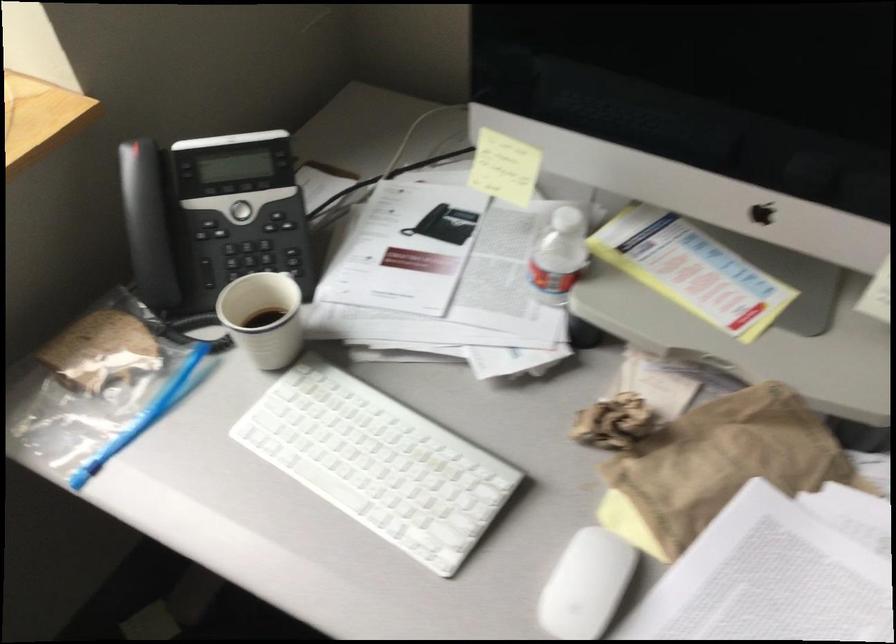
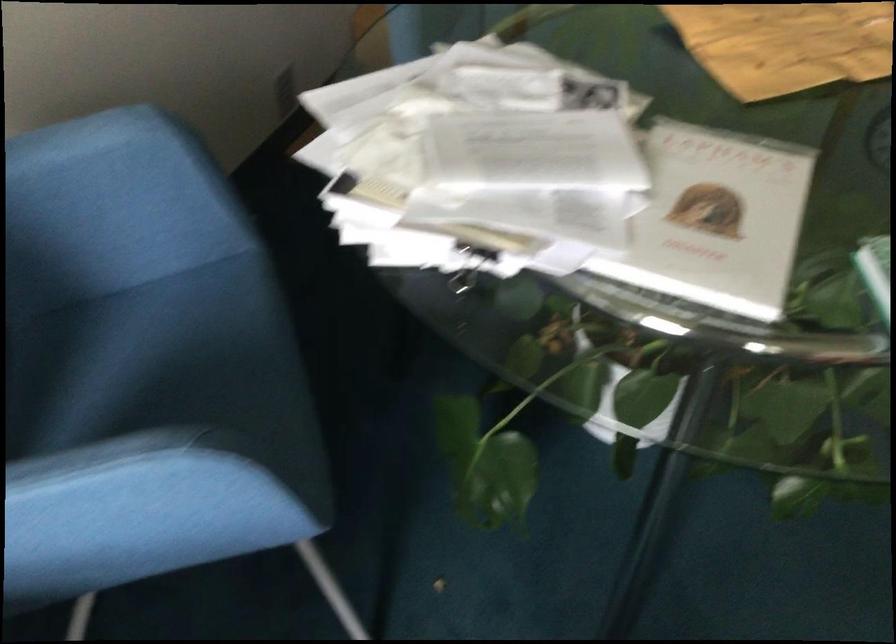
First-person continuous shooting, in which direction is the camera rotating?

The camera rotated toward right-down.